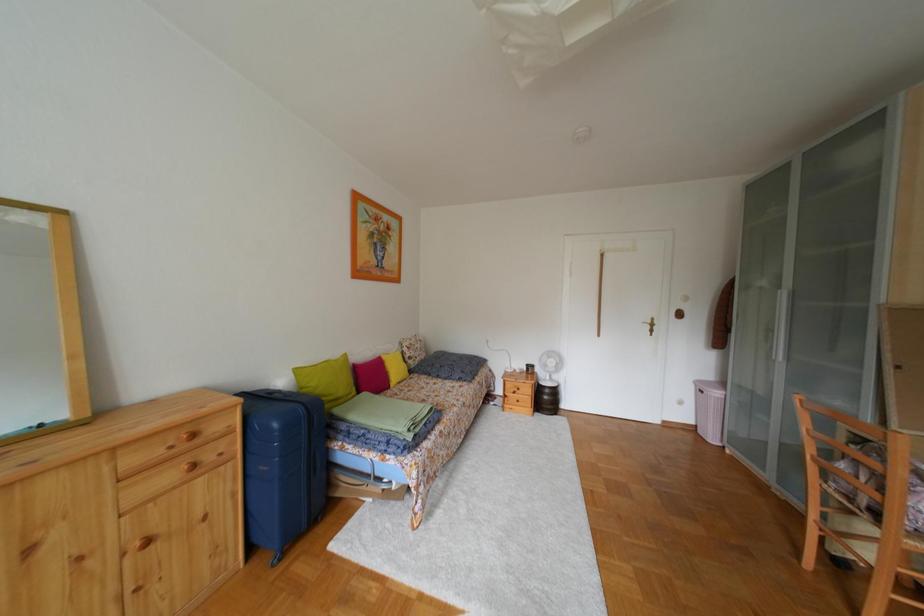
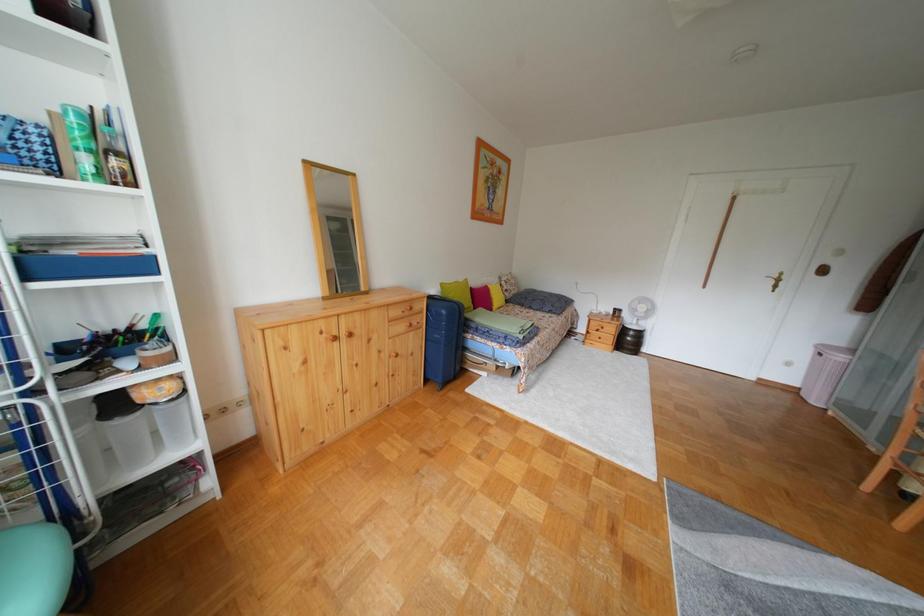
Question: How did the camera likely rotate?

Choices:
 (A) Left
 (B) Right
 (C) Up
 (D) Down

Answer: (A)